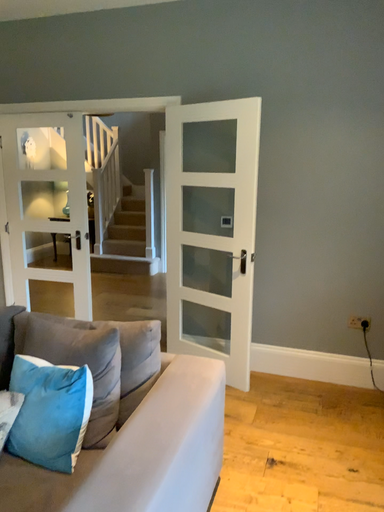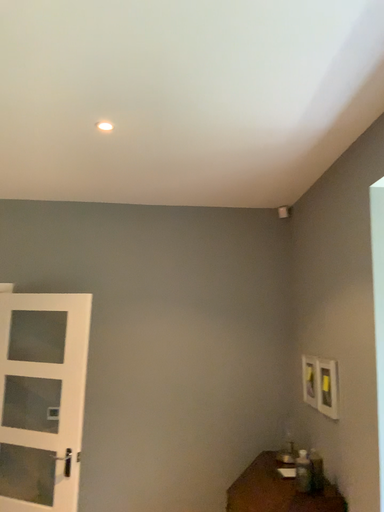
Question: Which way did the camera rotate in the video?

Choices:
 (A) rotated downward
 (B) rotated upward

Answer: (B)